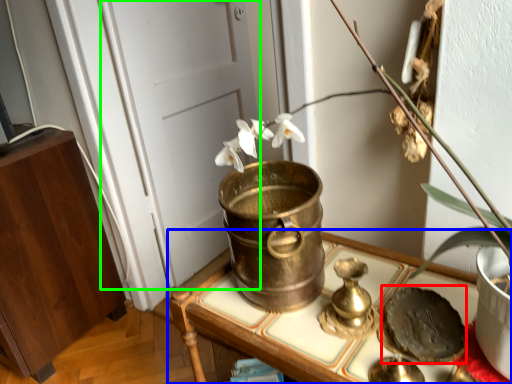
Question: Based on their relative distances, which object is farther from food (highlighted by a red box)? Choose from furniture (highlighted by a blue box) and door (highlighted by a green box).

Choices:
 (A) furniture
 (B) door

Answer: (B)